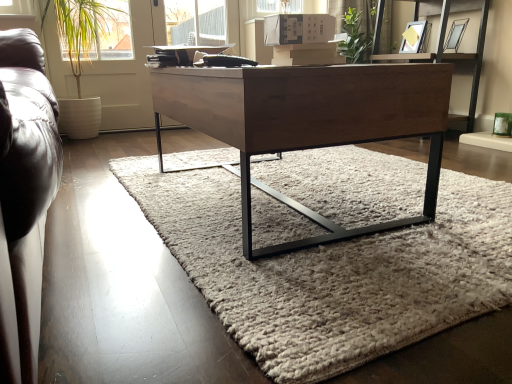
Where is `free spot to the right of wooden desk at center`? free spot to the right of wooden desk at center is located at coordinates (398, 187).